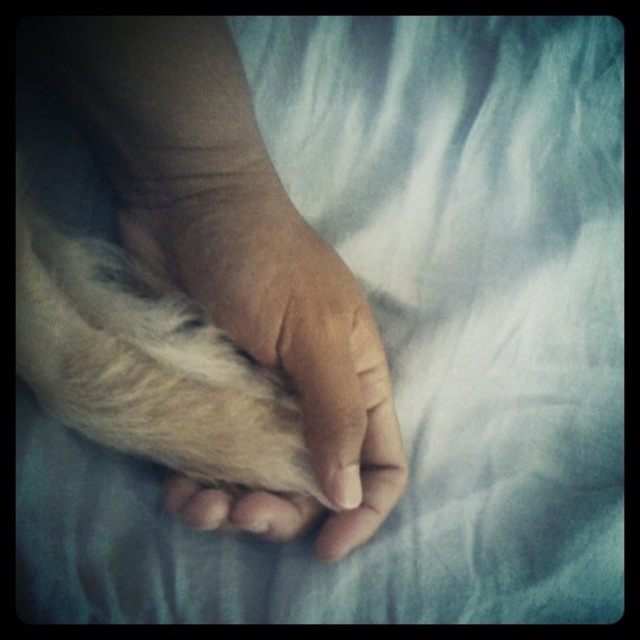
You are a photographer trying to capture the texture of the fuzzy white fur at center and the dry skin paw at center. Since the background is blurred, which object will appear more in focus in the final photo?

The dry skin paw at center will appear more in focus because it is closer to the viewer than the fuzzy white fur at center.

You are a veterinarian examining a cat and notice two features on its paws. You see the dry skin paw at center and the fuzzy white fur at center. Which one is located to the right?

The dry skin paw at center is located to the right of the fuzzy white fur at center.

You are a dermatologist examining a patient. You notice a spot on their skin at point (284, 324). According to the image, what is the nature of this spot?

The spot at point (284, 324) is described as dry skin paw at center, indicating it is a dry skin area with possible scaling or rough texture.